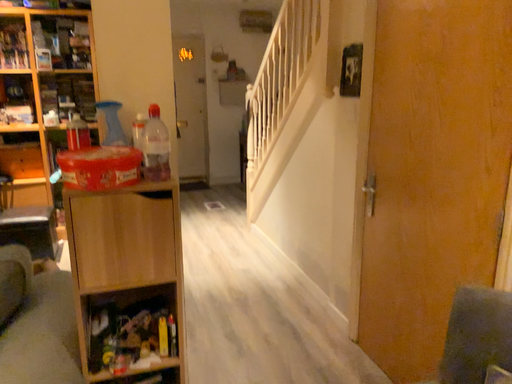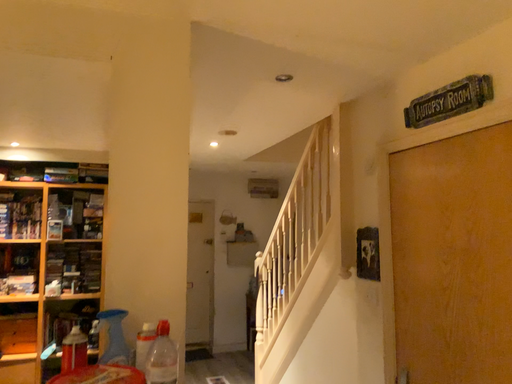
Question: How did the camera likely rotate when shooting the video?

Choices:
 (A) rotated upward
 (B) rotated downward

Answer: (A)